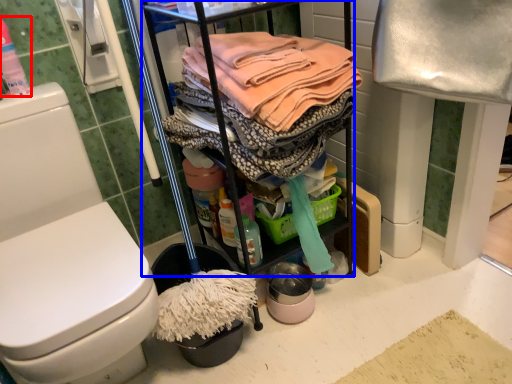
Question: Which object is closer to the camera taking this photo, cleaning products (highlighted by a red box) or cabinetry (highlighted by a blue box)?

Choices:
 (A) cleaning products
 (B) cabinetry

Answer: (B)